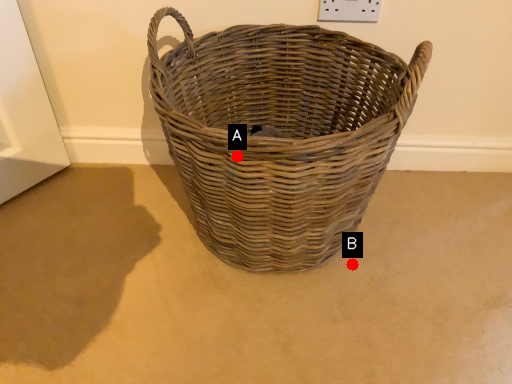
Question: Two points are circled on the image, labeled by A and B beside each circle. Which point is closer to the camera?

Choices:
 (A) A is closer
 (B) B is closer

Answer: (A)